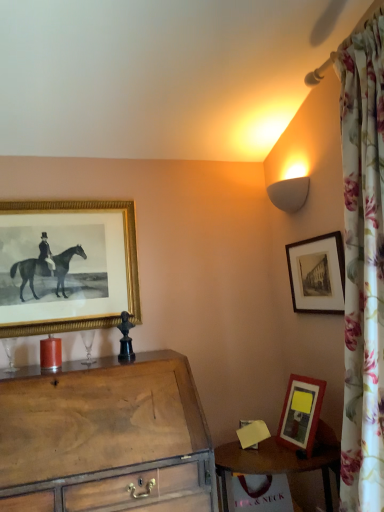
Question: Is matte glass candle at left bigger than black matte picture frame at upper right, the 1th picture frame positioned from the right?

Choices:
 (A) no
 (B) yes

Answer: (A)

Question: Would you consider matte glass candle at left to be distant from black matte picture frame at upper right, the 1th picture frame positioned from the right?

Choices:
 (A) no
 (B) yes

Answer: (B)

Question: Is matte glass candle at left to the right of black matte picture frame at upper right, the 1th picture frame positioned from the right, from the viewer's perspective?

Choices:
 (A) yes
 (B) no

Answer: (B)

Question: Does matte glass candle at left have a greater width compared to black matte picture frame at upper right, the 1th picture frame positioned from the right?

Choices:
 (A) no
 (B) yes

Answer: (B)

Question: From the image's perspective, is matte glass candle at left on top of black matte picture frame at upper right, which is the second picture frame in left-to-right order?

Choices:
 (A) no
 (B) yes

Answer: (A)

Question: Is gold textured picture frame at upper left, which ranks as the 1th picture frame in left-to-right order, inside the boundaries of black matte picture frame at upper right, the 1th picture frame positioned from the right, or outside?

Choices:
 (A) inside
 (B) outside

Answer: (B)

Question: From their relative heights in the image, would you say gold textured picture frame at upper left, the 2th picture frame viewed from the right, is taller or shorter than black matte picture frame at upper right, which is the second picture frame in left-to-right order?

Choices:
 (A) short
 (B) tall

Answer: (B)

Question: Considering the positions of gold textured picture frame at upper left, which ranks as the 1th picture frame in left-to-right order, and black matte picture frame at upper right, the 1th picture frame positioned from the right, in the image, is gold textured picture frame at upper left, which ranks as the 1th picture frame in left-to-right order, wider or thinner than black matte picture frame at upper right, the 1th picture frame positioned from the right,?

Choices:
 (A) wide
 (B) thin

Answer: (A)

Question: Does point (59, 271) appear closer or farther from the camera than point (299, 302)?

Choices:
 (A) closer
 (B) farther

Answer: (A)

Question: Based on their sizes in the image, would you say gold textured picture frame at upper left, which ranks as the 1th picture frame in left-to-right order, is bigger or smaller than matte glass candle at left?

Choices:
 (A) small
 (B) big

Answer: (B)

Question: Would you say gold textured picture frame at upper left, which ranks as the 1th picture frame in left-to-right order, is to the left or to the right of matte glass candle at left in the picture?

Choices:
 (A) right
 (B) left

Answer: (A)

Question: In terms of height, does gold textured picture frame at upper left, the 2th picture frame viewed from the right, look taller or shorter compared to matte glass candle at left?

Choices:
 (A) tall
 (B) short

Answer: (A)

Question: Is gold textured picture frame at upper left, which ranks as the 1th picture frame in left-to-right order, in front of or behind matte glass candle at left in the image?

Choices:
 (A) behind
 (B) front

Answer: (A)

Question: In terms of width, does wooden chest of drawers at lower left look wider or thinner when compared to black matte picture frame at upper right, which is the second picture frame in left-to-right order?

Choices:
 (A) wide
 (B) thin

Answer: (A)

Question: In terms of height, does wooden chest of drawers at lower left look taller or shorter compared to black matte picture frame at upper right, which is the second picture frame in left-to-right order?

Choices:
 (A) tall
 (B) short

Answer: (A)